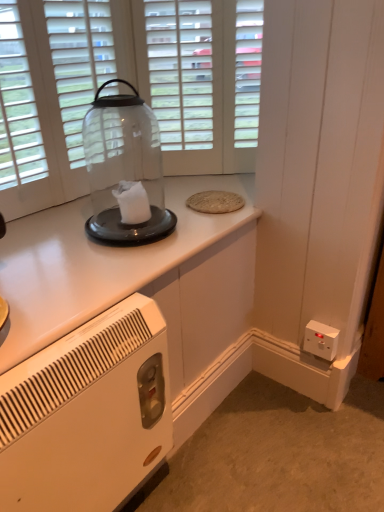
In order to click on vacant area on top of white glossy cabinet at upper center (from a real-world perspective) in this screenshot , I will do `click(131, 237)`.